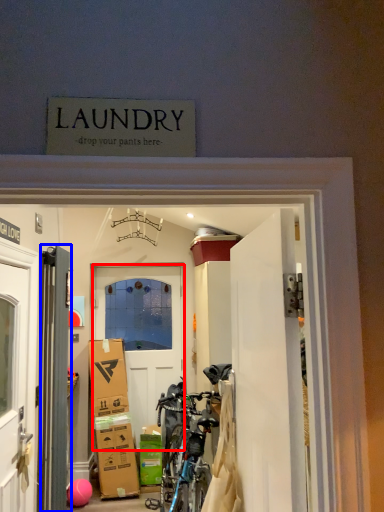
Question: Which of the following is the farthest to the observer, door (highlighted by a red box) or door (highlighted by a blue box)?

Choices:
 (A) door
 (B) door

Answer: (A)